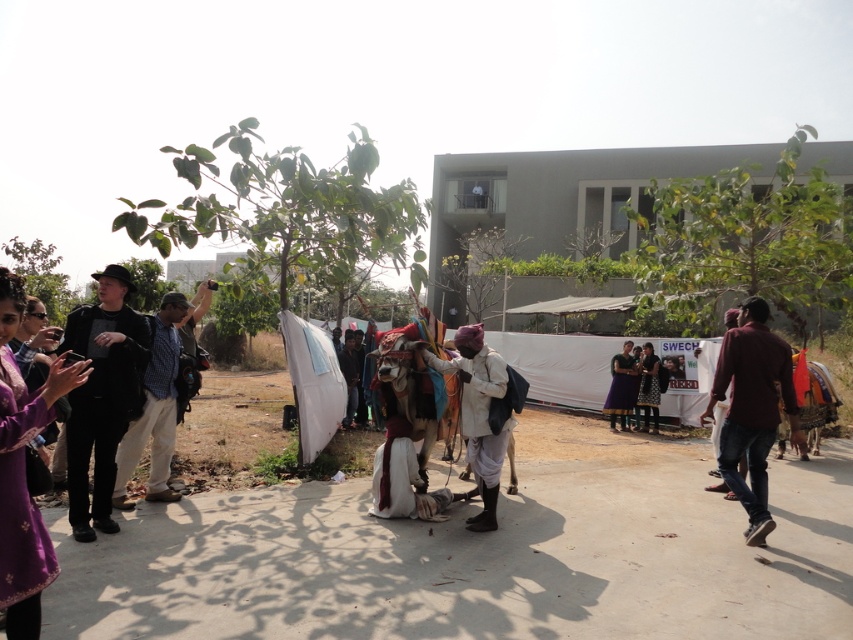
You are a photographer trying to capture the scene. You notice the dark brown leather pants at right and the dark purple fabric at center. Which object should you focus on first if you want to photograph the one that is higher in the image?

The dark brown leather pants at right is located above the dark purple fabric at center, so you should focus on the dark brown leather pants at right first.

You are a photographer standing at the center of the scene. You want to capture a photo that includes both the dark brown leather pants at right and the dark purple fabric at center. Given that your camera has a maximum zoom range of 5 meters, can you fit both objects into the same frame without moving closer?

The dark brown leather pants at right and dark purple fabric at center are 6.71 meters apart from each other. Since the camera can only zoom up to 5 meters, the distance between them exceeds the maximum zoom range. Therefore, you cannot fit both objects into the same frame without moving closer.